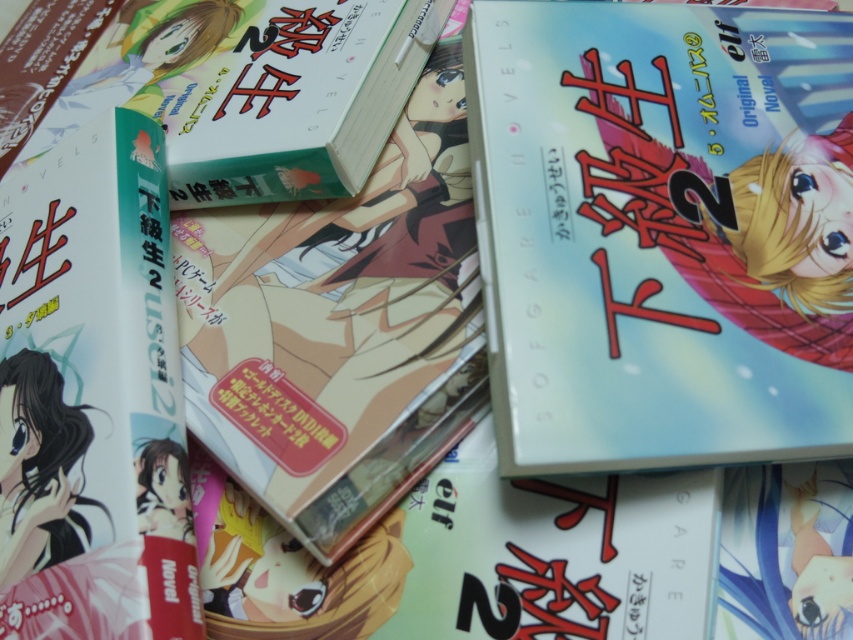
Identify the location of matte blue novel at center. (663, 230).

Find the location of a particular element. The image size is (853, 640). matte blue novel at center is located at coordinates (663, 230).

Who is higher up, hardcover novel at left or hardcover book at upper left?

hardcover book at upper left

Is the position of hardcover novel at left less distant than that of hardcover book at upper left?

That is True.

Describe the element at coordinates (91, 396) in the screenshot. The image size is (853, 640). I see `hardcover novel at left` at that location.

Where is `hardcover novel at left`? The height and width of the screenshot is (640, 853). hardcover novel at left is located at coordinates (91, 396).

Does matte blue novel at center have a smaller size compared to hardcover novel at left?

No, matte blue novel at center is not smaller than hardcover novel at left.

Is matte blue novel at center closer to camera compared to hardcover novel at left?

No, it is behind hardcover novel at left.

Locate an element on the screen. The image size is (853, 640). matte blue novel at center is located at coordinates (663, 230).